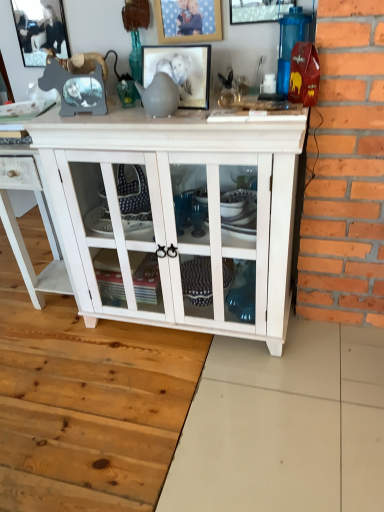
Question: Is wooden picture frame at upper center, the second picture frame from the right, next to white wood cupboard at center?

Choices:
 (A) yes
 (B) no

Answer: (B)

Question: Does wooden picture frame at upper center, the second picture frame from the right, come in front of white wood cupboard at center?

Choices:
 (A) yes
 (B) no

Answer: (B)

Question: From a real-world perspective, is wooden picture frame at upper center, placed as the 3th picture frame when sorted from left to right, on top of white wood cupboard at center?

Choices:
 (A) no
 (B) yes

Answer: (B)

Question: Does wooden picture frame at upper center, the second picture frame from the right, have a lesser height compared to white wood cupboard at center?

Choices:
 (A) yes
 (B) no

Answer: (A)

Question: Is the depth of wooden picture frame at upper center, the second picture frame from the right, greater than that of white wood cupboard at center?

Choices:
 (A) yes
 (B) no

Answer: (A)

Question: Does point (31, 169) appear closer or farther from the camera than point (56, 17)?

Choices:
 (A) farther
 (B) closer

Answer: (A)

Question: Visually, is white wood cabinet at center positioned to the left or to the right of metallic silver picture frame at upper left, arranged as the first picture frame when viewed from the left?

Choices:
 (A) right
 (B) left

Answer: (B)

Question: Is white wood cabinet at center wider or thinner than metallic silver picture frame at upper left, the fourth picture frame viewed from the right?

Choices:
 (A) thin
 (B) wide

Answer: (B)

Question: Choose the correct answer: Is white wood cabinet at center inside metallic silver picture frame at upper left, arranged as the first picture frame when viewed from the left, or outside it?

Choices:
 (A) inside
 (B) outside

Answer: (B)

Question: From the image's perspective, relative to white wood cabinet at center, is matte glass picture frame at center, which is the third picture frame from right to left, above or below?

Choices:
 (A) below
 (B) above

Answer: (B)

Question: In the image, is matte glass picture frame at center, which ranks as the 2th picture frame in left-to-right order, on the left side or the right side of white wood cabinet at center?

Choices:
 (A) right
 (B) left

Answer: (A)

Question: Considering the positions of matte glass picture frame at center, which ranks as the 2th picture frame in left-to-right order, and white wood cabinet at center in the image, is matte glass picture frame at center, which ranks as the 2th picture frame in left-to-right order, taller or shorter than white wood cabinet at center?

Choices:
 (A) short
 (B) tall

Answer: (A)

Question: Does point (201, 60) appear closer or farther from the camera than point (71, 287)?

Choices:
 (A) farther
 (B) closer

Answer: (B)

Question: Considering the positions of matte glass picture frame at center, which ranks as the 2th picture frame in left-to-right order, and white wood cupboard at center in the image, is matte glass picture frame at center, which ranks as the 2th picture frame in left-to-right order, taller or shorter than white wood cupboard at center?

Choices:
 (A) tall
 (B) short

Answer: (B)

Question: Is matte glass picture frame at center, which ranks as the 2th picture frame in left-to-right order, wider or thinner than white wood cupboard at center?

Choices:
 (A) wide
 (B) thin

Answer: (B)